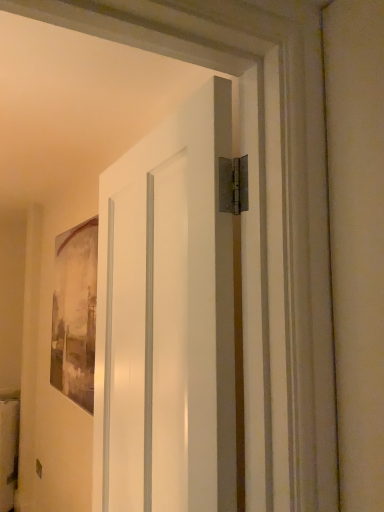
The image size is (384, 512). I want to click on matte gray painting at left, so click(x=75, y=313).

The width and height of the screenshot is (384, 512). What do you see at coordinates (75, 313) in the screenshot?
I see `matte gray painting at left` at bounding box center [75, 313].

The image size is (384, 512). Describe the element at coordinates (167, 320) in the screenshot. I see `white matte door at center` at that location.

The height and width of the screenshot is (512, 384). I want to click on white matte door at center, so click(x=167, y=320).

Identify the location of matte gray painting at left. The image size is (384, 512). (75, 313).

In the image, is matte gray painting at left on the left side or the right side of white matte door at center?

matte gray painting at left is to the left of white matte door at center.

Considering the positions of objects matte gray painting at left and white matte door at center in the image provided, who is in front, matte gray painting at left or white matte door at center?

Positioned in front is white matte door at center.

Which is in front, point (89, 257) or point (173, 120)?

Positioned in front is point (173, 120).

From the image's perspective, is matte gray painting at left located above or below white matte door at center?

Clearly, from the image's perspective, matte gray painting at left is below white matte door at center.

From a real-world perspective, is matte gray painting at left on top of white matte door at center?

Yes.

Considering the relative sizes of matte gray painting at left and white matte door at center in the image provided, is matte gray painting at left thinner than white matte door at center?

Yes, matte gray painting at left is thinner than white matte door at center.

Who is shorter, matte gray painting at left or white matte door at center?

With less height is matte gray painting at left.

Between matte gray painting at left and white matte door at center, which one has larger size?

white matte door at center is bigger.

Is matte gray painting at left positioned beyond the bounds of white matte door at center?

That's correct, matte gray painting at left is outside of white matte door at center.

Are matte gray painting at left and white matte door at center far apart?

matte gray painting at left is positioned a significant distance from white matte door at center.

Is matte gray painting at left facing towards white matte door at center?

No, matte gray painting at left is not aimed at white matte door at center.

Measure the distance between matte gray painting at left and white matte door at center.

matte gray painting at left is 1.02 meters away from white matte door at center.

Image resolution: width=384 pixels, height=512 pixels. Find the location of `picture frame above the white matte door at center (from a real-world perspective)`. picture frame above the white matte door at center (from a real-world perspective) is located at coordinates (75, 313).

Between white matte door at center and matte gray painting at left, which one appears on the right side from the viewer's perspective?

white matte door at center.

Which object is further away from the camera taking this photo, white matte door at center or matte gray painting at left?

matte gray painting at left is behind.

Which is closer, (153, 230) or (87, 258)?

The point (153, 230) is closer to the camera.

From the image's perspective, is white matte door at center on matte gray painting at left?

Yes.

From a real-world perspective, between white matte door at center and matte gray painting at left, who is vertically lower?

white matte door at center is physically lower.

In terms of width, does white matte door at center look wider or thinner when compared to matte gray painting at left?

Clearly, white matte door at center has more width compared to matte gray painting at left.

Considering the relative sizes of white matte door at center and matte gray painting at left in the image provided, is white matte door at center taller than matte gray painting at left?

Correct, white matte door at center is much taller as matte gray painting at left.

Which of these two, white matte door at center or matte gray painting at left, is bigger?

white matte door at center is bigger.

Would you say white matte door at center contains matte gray painting at left?

No, matte gray painting at left is not a part of white matte door at center.

Is white matte door at center beside matte gray painting at left?

They are not placed beside each other.

Is white matte door at center looking in the opposite direction of matte gray painting at left?

white matte door at center is not turned away from matte gray painting at left.

What's the angular difference between white matte door at center and matte gray painting at left's facing directions?

The angular difference between white matte door at center and matte gray painting at left is 1.97 degrees.

Image resolution: width=384 pixels, height=512 pixels. I want to click on picture frame behind the white matte door at center, so click(x=75, y=313).

Identify the location of picture frame behind the white matte door at center. The image size is (384, 512). (75, 313).

Where is `door directly beneath the matte gray painting at left (from a real-world perspective)`? door directly beneath the matte gray painting at left (from a real-world perspective) is located at coordinates (167, 320).